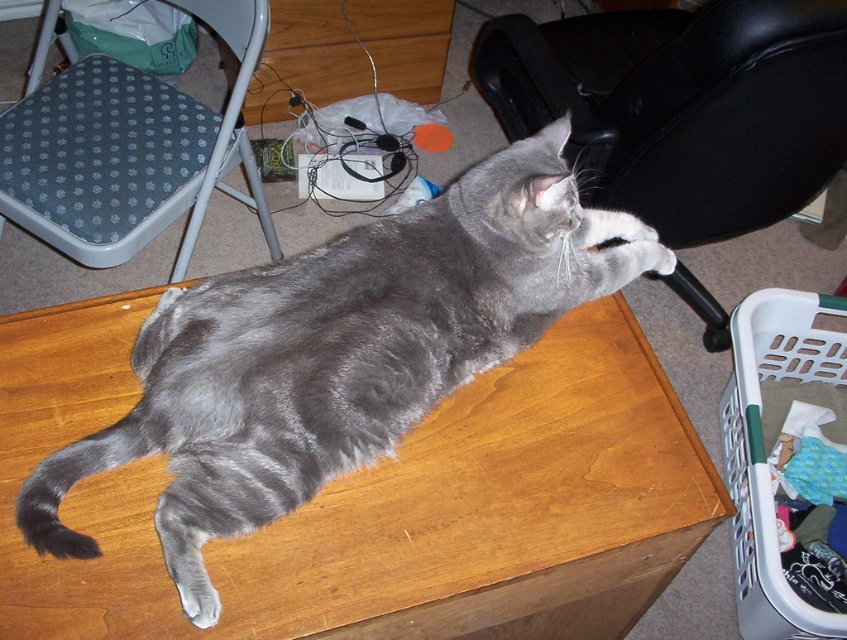
Looking at this image, you are a person sitting at the desk where the gray tabby cat is resting. You need to reach for an object located at point [681,106]. Which object is at that location?

The point [681,106] is on the black leather swivel chair at upper right.